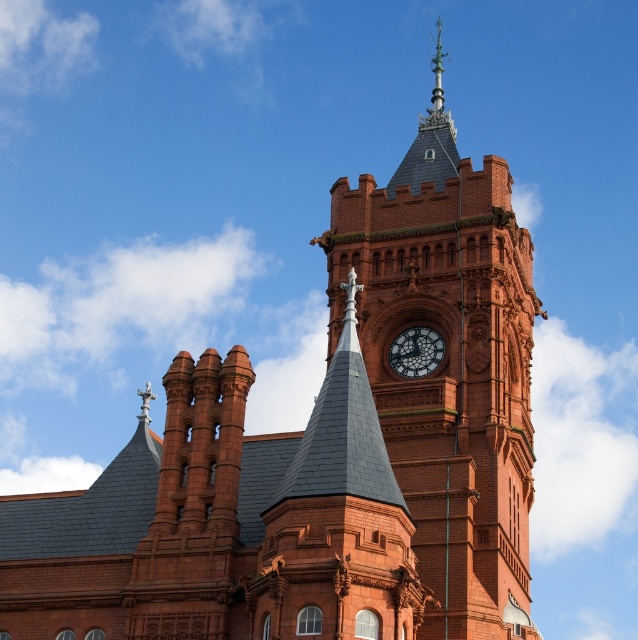
Between matte brick clock tower at center and polished brass clock at center, which one has more height?

With more height is matte brick clock tower at center.

Is matte brick clock tower at center taller than polished brass clock at center?

Yes.

Is point (457, 234) more distant than point (420, 326)?

Yes, point (457, 234) is behind point (420, 326).

At what (x,y) coordinates should I click in order to perform the action: click on matte brick clock tower at center. Please return your answer as a coordinate pair (x, y). Looking at the image, I should click on (449, 365).